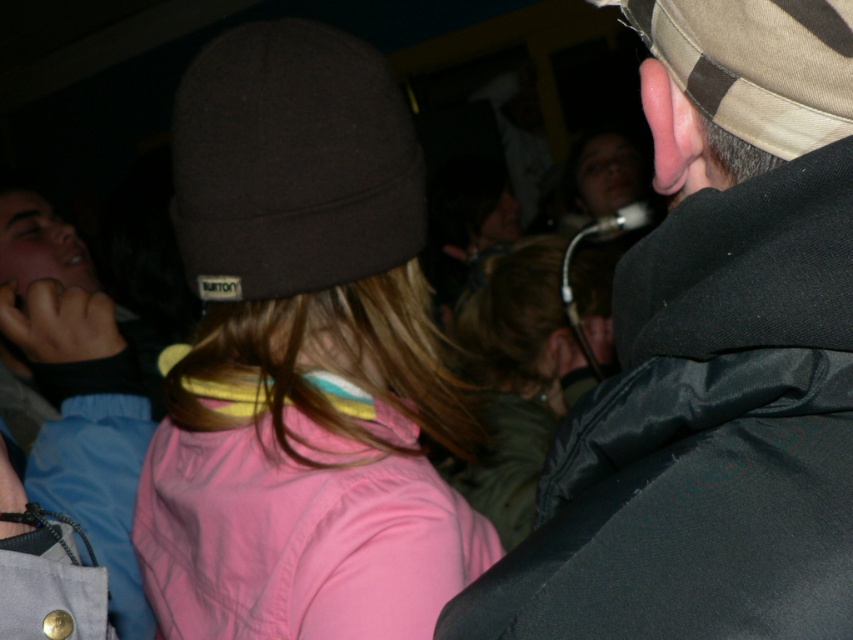
Question: Does matte brown beanie at center appear under light blue denim jacket at left?

Choices:
 (A) yes
 (B) no

Answer: (B)

Question: Is light blue denim jacket at left to the left of khaki canvas cap at upper right from the viewer's perspective?

Choices:
 (A) no
 (B) yes

Answer: (B)

Question: Which object is the closest to the camouflage fabric cap at upper right?

Choices:
 (A) matte brown beanie at center
 (B) dark brown knit beanie at upper left

Answer: (A)

Question: Among these points, which one is nearest to the camera?

Choices:
 (A) (399, 228)
 (B) (830, 38)
 (C) (212, 568)
 (D) (796, 541)

Answer: (D)

Question: Which point is farther to the camera?

Choices:
 (A) matte brown beanie at center
 (B) dark brown knit beanie at upper left
 (C) khaki canvas cap at upper right

Answer: (B)

Question: Is the position of dark brown knit beanie at upper left less distant than that of khaki canvas cap at upper right?

Choices:
 (A) no
 (B) yes

Answer: (A)